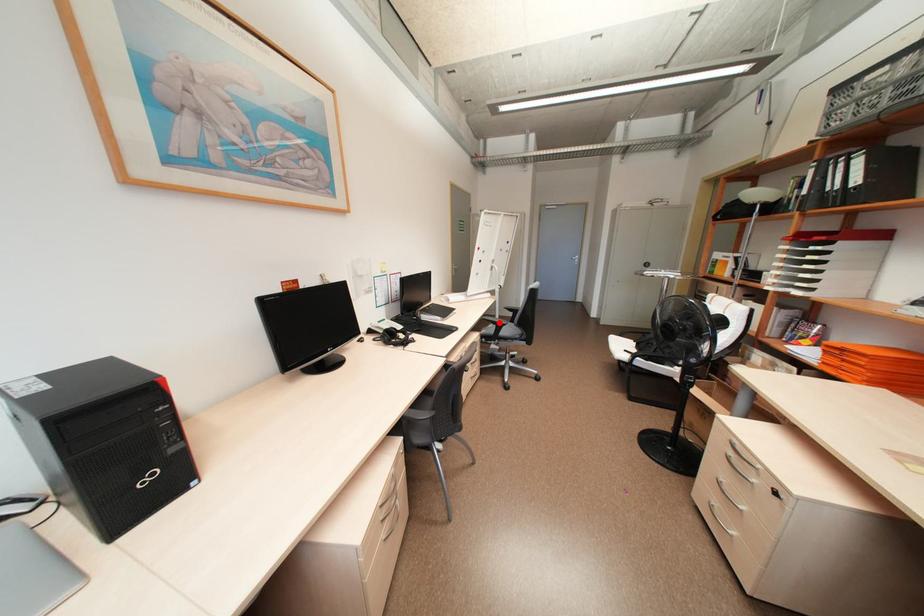
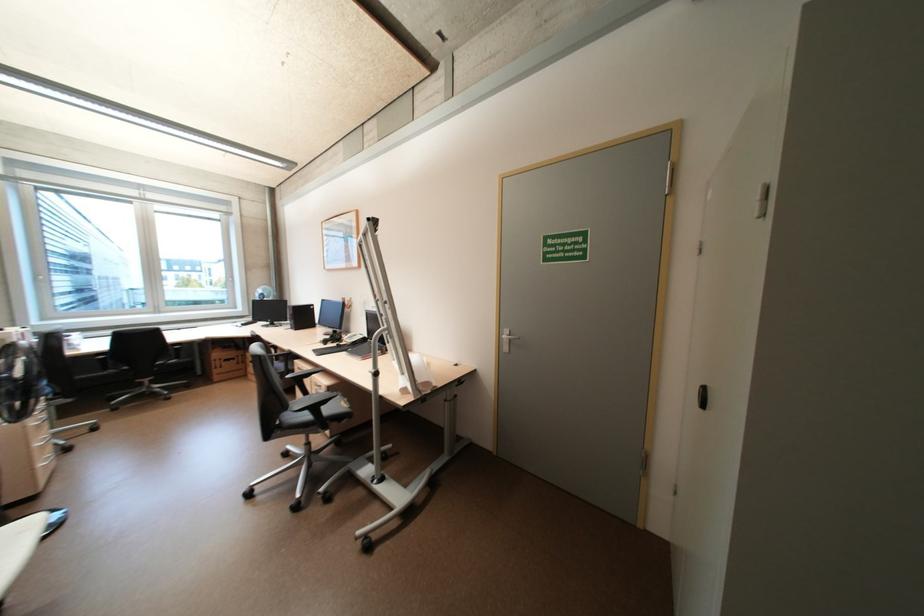
In the second image, find the point that corresponds to the highlighted location in the first image.

(314, 377)